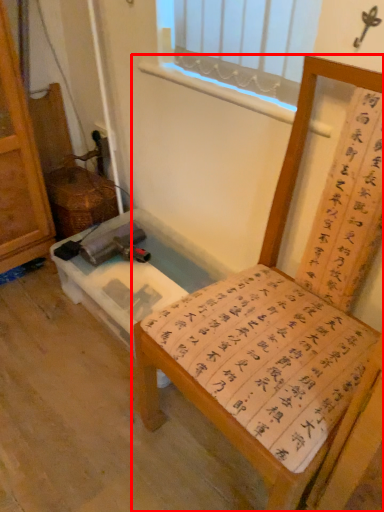
Question: From the image's perspective, where is furniture (annotated by the red box) located in relation to vanity in the image?

Choices:
 (A) below
 (B) above

Answer: (A)